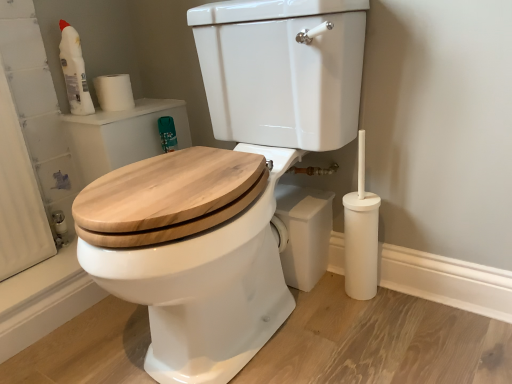
Locate an element on the screen. The height and width of the screenshot is (384, 512). free space in front of white matte toilet paper at upper left is located at coordinates (106, 114).